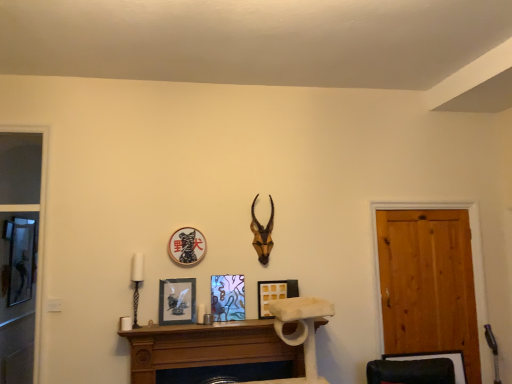
You are a GUI agent. You are given a task and a screenshot of the screen. Output one action in this format:
    pyautogui.click(x=<x>, y=<y>)
    Task: Click on the free space above wooden door at right (from a real-world perspective)
    This screenshot has height=384, width=512.
    Given the screenshot: What is the action you would take?
    pyautogui.click(x=420, y=207)